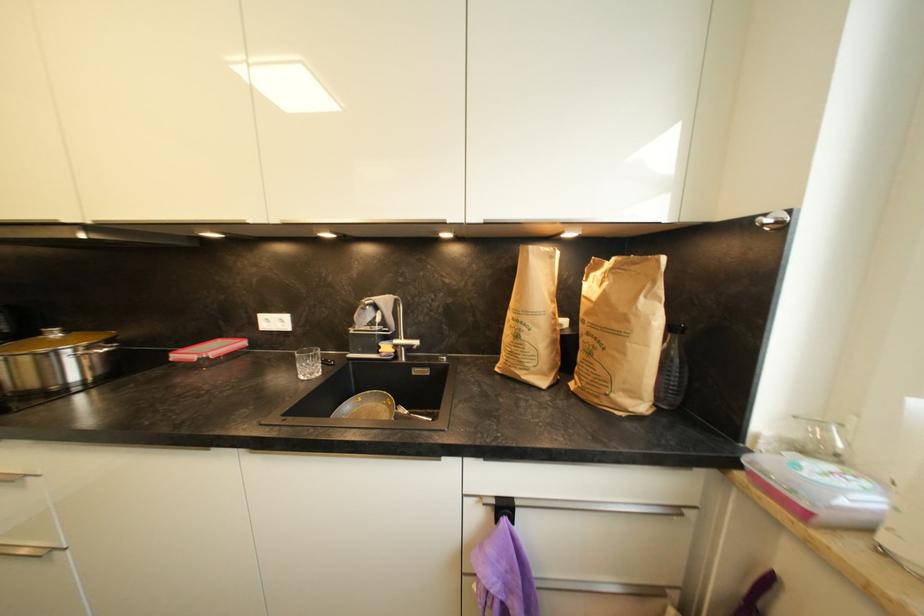
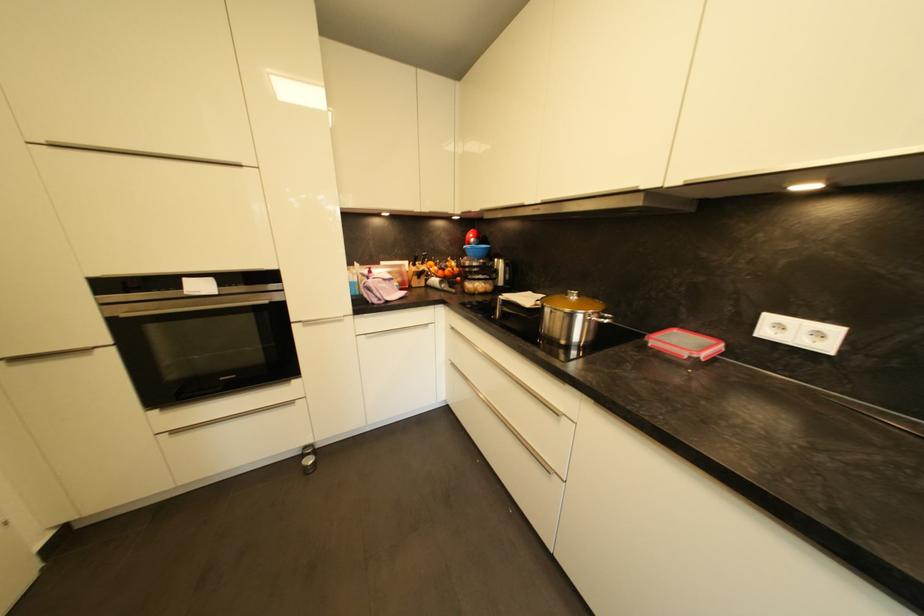
Question: The camera is either moving clockwise (left) or counter-clockwise (right) around the object. The first image is from the beginning of the video and the second image is from the end. Is the camera moving left or right when shooting the video?

Choices:
 (A) Left
 (B) Right

Answer: (B)